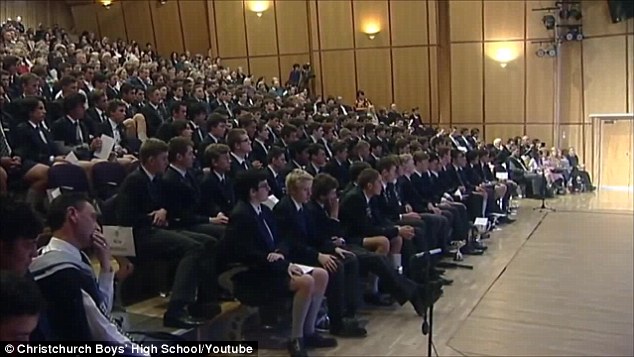
Identify the location of gym lights. The image size is (634, 357). (501, 44), (354, 20), (260, 6), (110, 0).